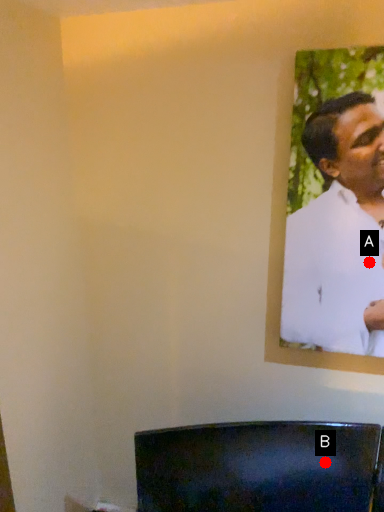
Question: Two points are circled on the image, labeled by A and B beside each circle. Which of the following is the closest to the observer?

Choices:
 (A) A is closer
 (B) B is closer

Answer: (A)